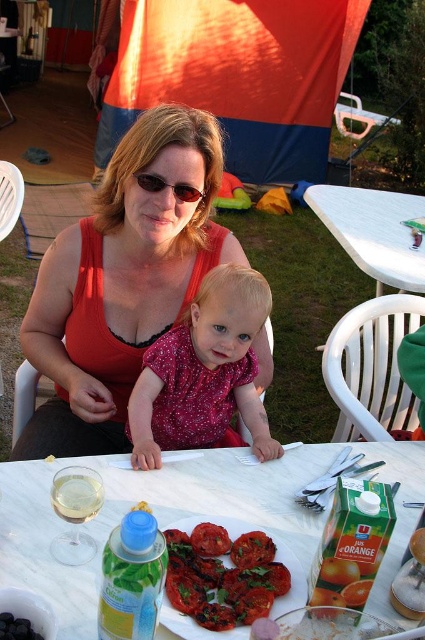
Is tomato at center closer to camera compared to glossy plastic tomato at center?

No, it is not.

Is point (223, 532) less distant than point (328, 580)?

No, (223, 532) is behind (328, 580).

Is point (226, 541) positioned after point (348, 576)?

Yes, point (226, 541) is farther from viewer.

At what (x,y) coordinates should I click in order to perform the action: click on tomato at center. Please return your answer as a coordinate pair (x, y). This screenshot has height=640, width=425. Looking at the image, I should click on (209, 540).

Describe the element at coordinates (121, 282) in the screenshot. I see `matte red tank top at center` at that location.

From the picture: Who is more forward, (121, 298) or (195, 573)?

Positioned in front is point (195, 573).

Locate an element on the screen. matte red tank top at center is located at coordinates (121, 282).

Who is positioned more to the right, shiny red tomato at center or brown plastic sunglasses at center?

shiny red tomato at center is more to the right.

What do you see at coordinates (252, 548) in the screenshot? I see `shiny red tomato at center` at bounding box center [252, 548].

Image resolution: width=425 pixels, height=640 pixels. I want to click on shiny red tomato at center, so click(x=252, y=548).